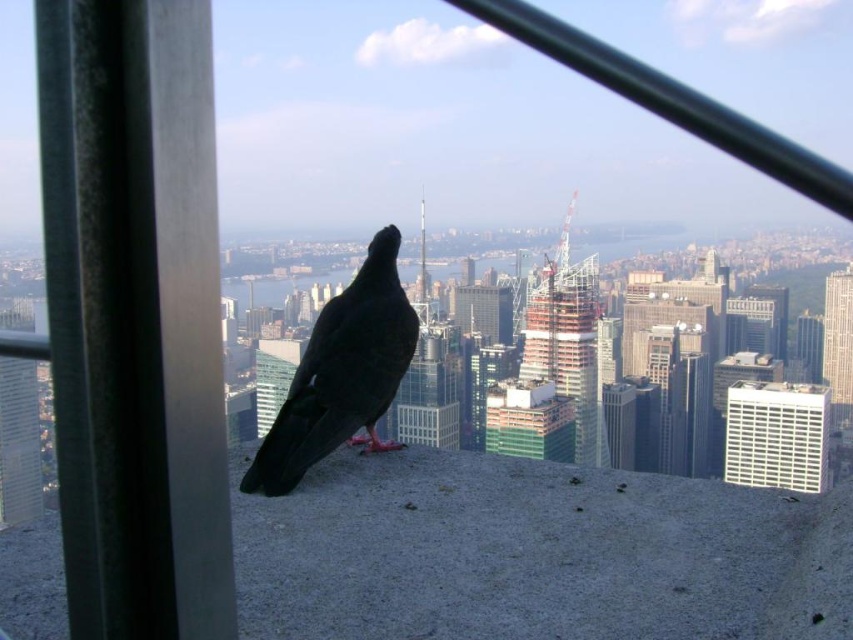
What do you see at coordinates (341, 372) in the screenshot? I see `black matte bird at center` at bounding box center [341, 372].

Does black matte bird at center come behind white textured window at center right?

No, black matte bird at center is closer to the viewer.

Is point (357, 321) farther from camera compared to point (766, 458)?

No, it is not.

Identify the location of black matte bird at center. (341, 372).